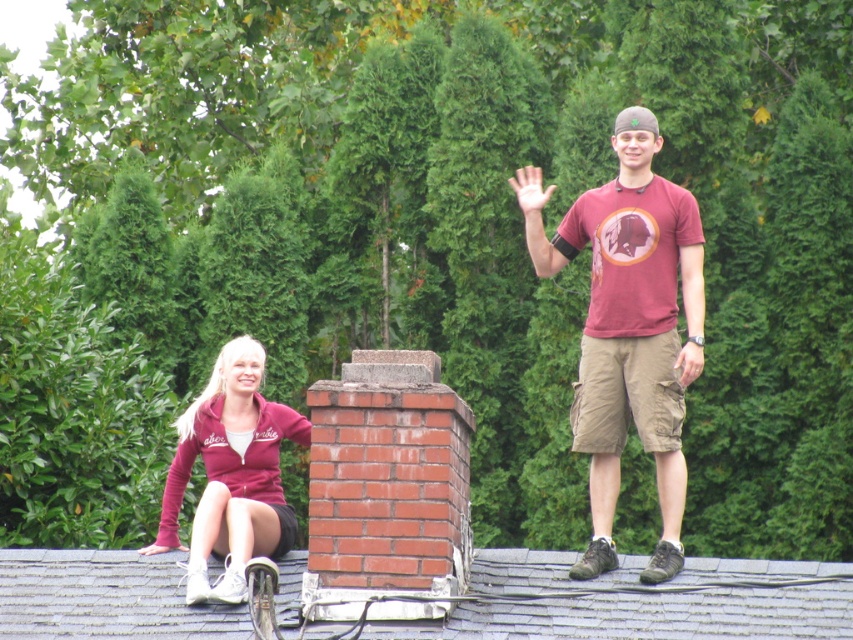
Question: Is gray shingles at center in front of maroon fleece jacket at lower left?

Choices:
 (A) yes
 (B) no

Answer: (A)

Question: Is matte red t-shirt at center thinner than maroon fleece jacket at lower left?

Choices:
 (A) no
 (B) yes

Answer: (B)

Question: Which object appears farthest from the camera in this image?

Choices:
 (A) matte red t-shirt at center
 (B) maroon fleece jacket at lower left
 (C) gray shingles at center

Answer: (A)

Question: Considering the relative positions of gray shingles at center and matte red t-shirt at center in the image provided, where is gray shingles at center located with respect to matte red t-shirt at center?

Choices:
 (A) above
 (B) below

Answer: (B)

Question: Which point appears closest to the camera in this image?

Choices:
 (A) 637,342
 (B) 141,582
 (C) 274,433

Answer: (B)

Question: Which of the following is the farthest from the observer?

Choices:
 (A) (630, 374)
 (B) (161, 616)

Answer: (A)